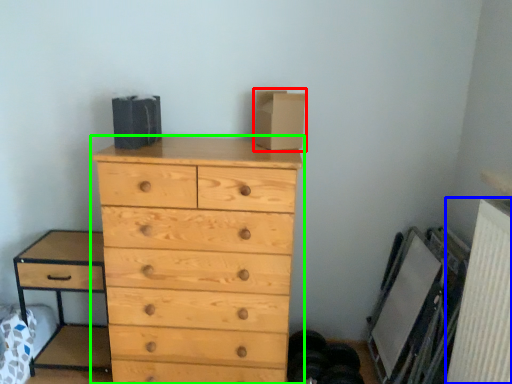
Question: Considering the real-world distances, which object is closest to cardboard box (highlighted by a red box)? radiator (highlighted by a blue box) or chest of drawers (highlighted by a green box).

Choices:
 (A) radiator
 (B) chest of drawers

Answer: (B)